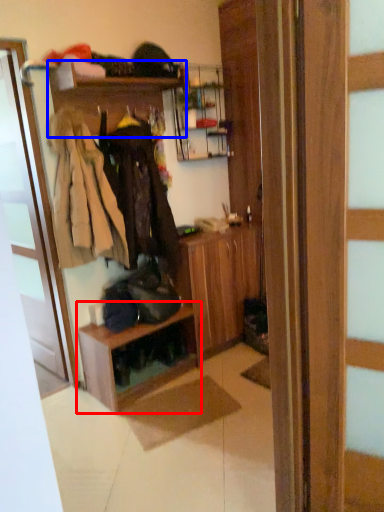
Question: Which object is further to the camera taking this photo, shelf (highlighted by a red box) or shelf (highlighted by a blue box)?

Choices:
 (A) shelf
 (B) shelf

Answer: (A)